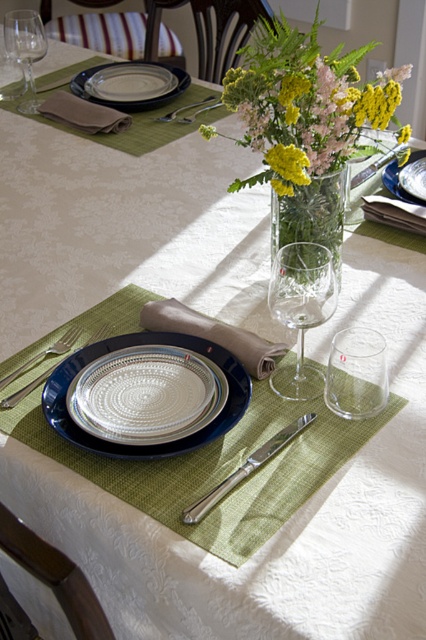
Consider the image. You are a server at a restaurant and need to place a new menu on the table. The menu is 12 inches wide. The transparent glass at center and the silver metallic fork at lower left are on the table. Can the menu fit between them without overlapping either?

The transparent glass at center has a width less than the silver metallic fork at lower left. Since the menu is 12 inches wide, it depends on the available space between them. However, the exact distance between the objects isn

Consider the image. You are looking at the dining table and notice two points marked on the image. The first point is at coordinates point (356, 372) and the second is at point (28, 358). Which point is closer to you?

Point (356, 372) is closer to the viewer than point (28, 358).